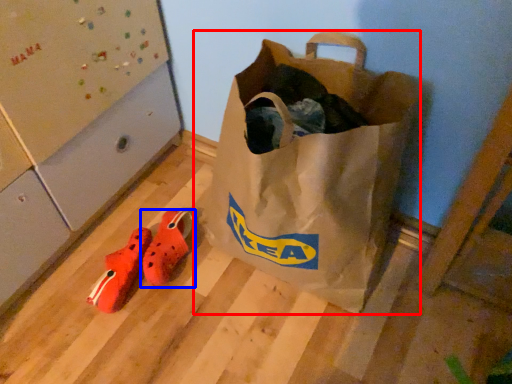
Question: Which of the following is the closest to the observer, luggage and bags (highlighted by a red box) or footwear (highlighted by a blue box)?

Choices:
 (A) luggage and bags
 (B) footwear

Answer: (A)